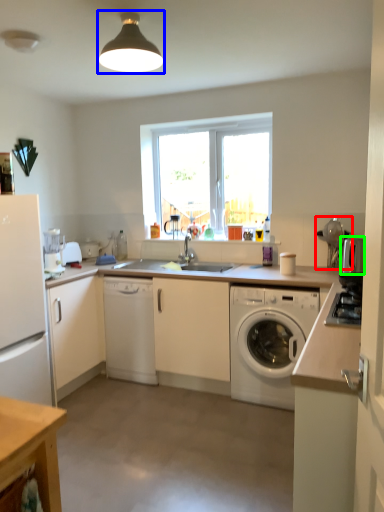
Question: Which is farther away from appliance (highlighted by a red box)? light fixture (highlighted by a blue box) or appliance (highlighted by a green box)?

Choices:
 (A) light fixture
 (B) appliance

Answer: (A)